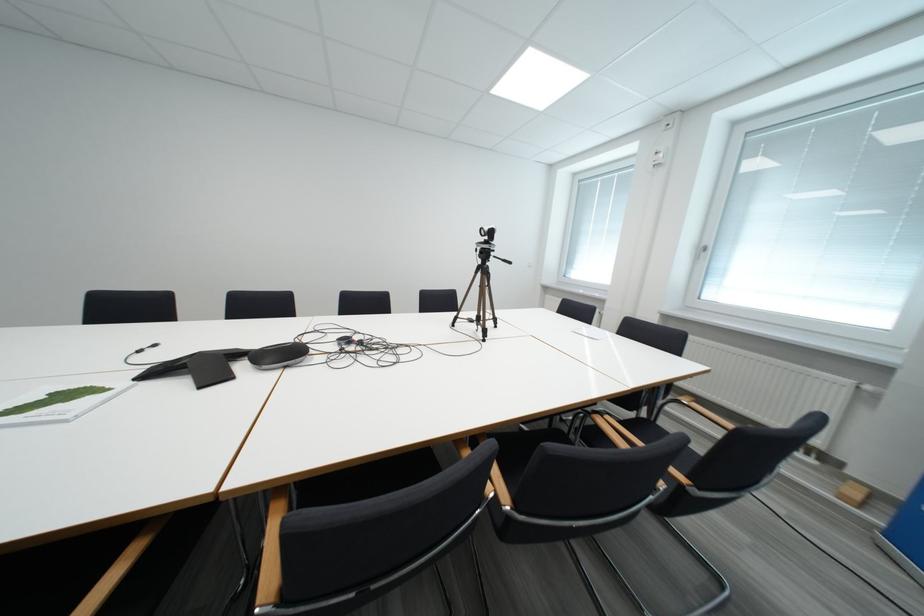
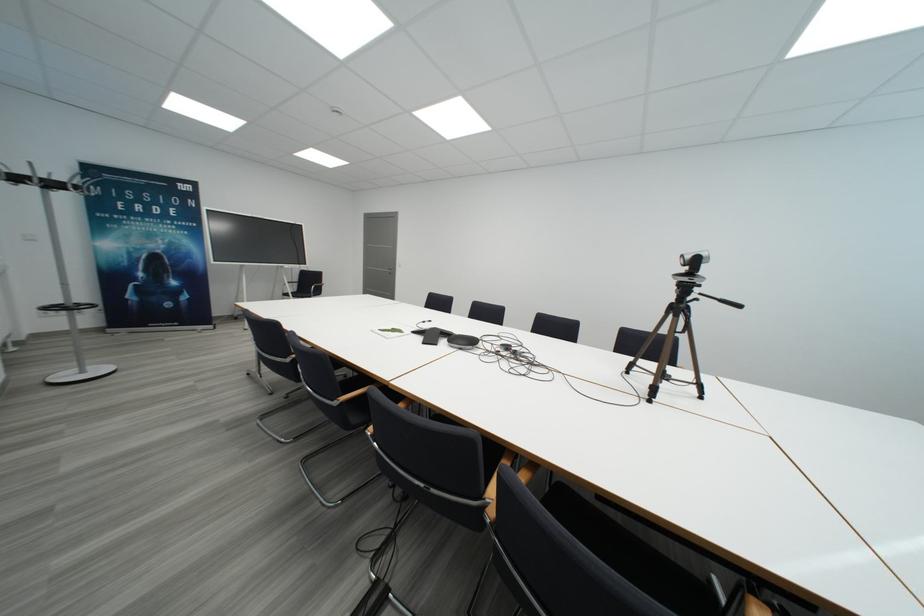
Find the pixel in the second image that matches point (529, 432) in the first image.

(718, 586)